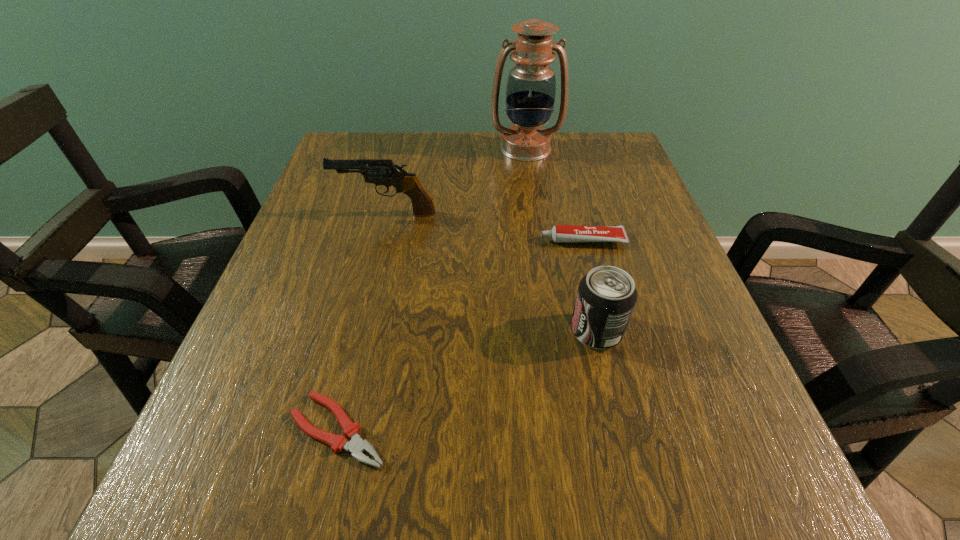
Locate an element on the screen. The image size is (960, 540). free space that satisfies the following two spatial constraints: 1. along the barrel of the gun; 2. on the right side of the tallest object is located at coordinates (402, 148).

You are a GUI agent. You are given a task and a screenshot of the screen. Output one action in this format:
    pyautogui.click(x=<x>, y=<y>)
    Task: Click on the free location that satisfies the following two spatial constraints: 1. on the front side of the oil lamp; 2. on the left side of the soda can
    The image size is (960, 540).
    Given the screenshot: What is the action you would take?
    pyautogui.click(x=553, y=331)

Image resolution: width=960 pixels, height=540 pixels. I want to click on vacant space that satisfies the following two spatial constraints: 1. on the back side of the second nearest object; 2. on the right side of the shortest object, so click(362, 331).